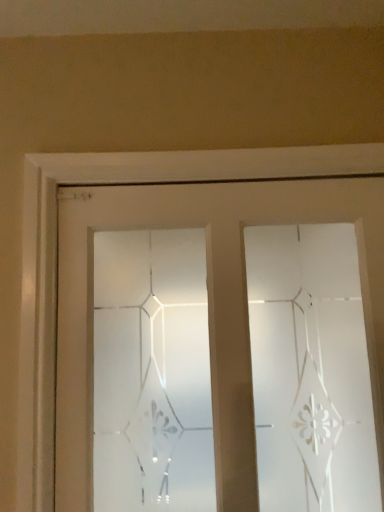
Describe the element at coordinates (208, 307) in the screenshot. I see `frosted glass door at center` at that location.

At what (x,y) coordinates should I click in order to perform the action: click on frosted glass door at center. Please return your answer as a coordinate pair (x, y). The width and height of the screenshot is (384, 512). Looking at the image, I should click on (208, 307).

Locate an element on the screen. frosted glass door at center is located at coordinates (208, 307).